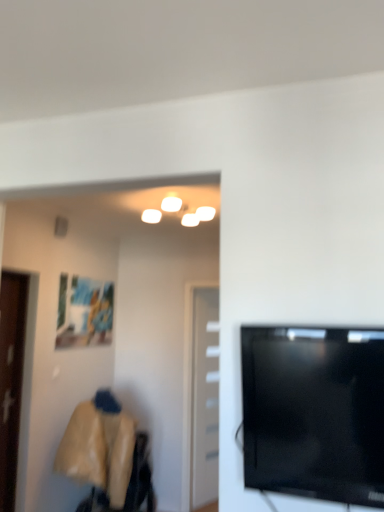
Question: Does black glossy tv at right appear on the right side of matte plastic picture frame at upper left?

Choices:
 (A) no
 (B) yes

Answer: (B)

Question: Are black glossy tv at right and matte plastic picture frame at upper left beside each other?

Choices:
 (A) no
 (B) yes

Answer: (A)

Question: Can you confirm if black glossy tv at right is taller than matte plastic picture frame at upper left?

Choices:
 (A) yes
 (B) no

Answer: (B)

Question: Does black glossy tv at right lie behind matte plastic picture frame at upper left?

Choices:
 (A) no
 (B) yes

Answer: (A)

Question: From the image's perspective, would you say black glossy tv at right is shown under matte plastic picture frame at upper left?

Choices:
 (A) yes
 (B) no

Answer: (B)

Question: Is black glossy tv at right oriented away from matte plastic picture frame at upper left?

Choices:
 (A) yes
 (B) no

Answer: (B)

Question: From the image's perspective, is matte plastic picture frame at upper left over black glossy tv at right?

Choices:
 (A) no
 (B) yes

Answer: (A)

Question: Is the position of matte plastic picture frame at upper left more distant than that of black glossy tv at right?

Choices:
 (A) no
 (B) yes

Answer: (B)

Question: Can you confirm if matte plastic picture frame at upper left is smaller than black glossy tv at right?

Choices:
 (A) yes
 (B) no

Answer: (A)

Question: Is black glossy tv at right at the back of matte plastic picture frame at upper left?

Choices:
 (A) yes
 (B) no

Answer: (B)

Question: Does matte plastic picture frame at upper left have a greater height compared to black glossy tv at right?

Choices:
 (A) yes
 (B) no

Answer: (A)

Question: From a real-world perspective, does matte plastic picture frame at upper left stand above black glossy tv at right?

Choices:
 (A) no
 (B) yes

Answer: (B)

Question: Is matte plastic picture frame at upper left not near white glossy door at center, which is the 1th door from right to left?

Choices:
 (A) no
 (B) yes

Answer: (B)